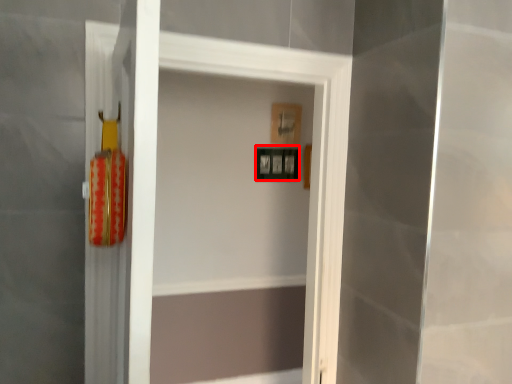
Question: Considering the relative positions of picture frame (annotated by the red box) and picture frame in the image provided, where is picture frame (annotated by the red box) located with respect to the staircase?

Choices:
 (A) left
 (B) right

Answer: (A)